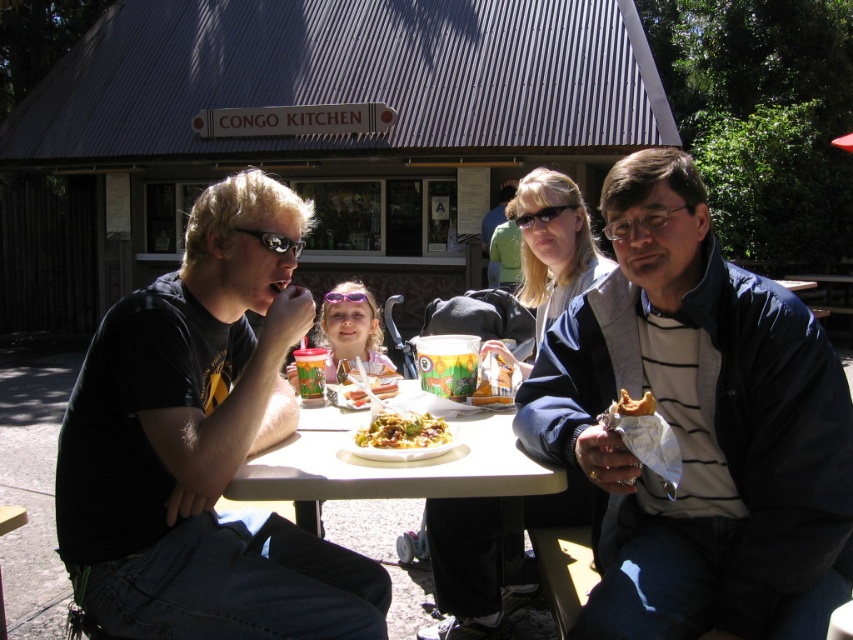
Question: Does matte black goggles at upper left appear over golden brown bread at center?

Choices:
 (A) yes
 (B) no

Answer: (A)

Question: Is matte black jacket at center thinner than golden brown bread at center?

Choices:
 (A) no
 (B) yes

Answer: (A)

Question: Does dark blue jacket at right have a smaller size compared to matte black goggles at upper left?

Choices:
 (A) no
 (B) yes

Answer: (A)

Question: Which point appears closest to the camera in this image?

Choices:
 (A) (294, 246)
 (B) (585, 369)
 (C) (360, 428)

Answer: (C)

Question: Estimate the real-world distances between objects in this image. Which object is closer to the black t-shirt at left?

Choices:
 (A) matte black jacket at center
 (B) golden brown bread at center
 (C) golden crispy fries at center
 (D) white plastic table at center

Answer: (D)

Question: Which point is farther to the camera?

Choices:
 (A) (734, 269)
 (B) (259, 236)
 (C) (434, 428)
 (D) (503, 445)

Answer: (C)